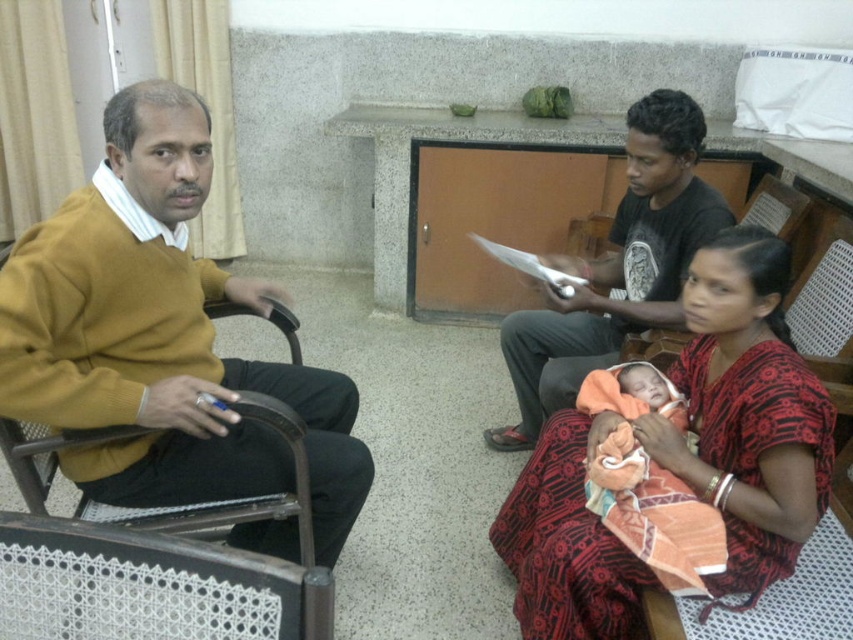
You are a nurse in this hospital scene and need to place a medical chart at a specific location. The chart must be placed at the point that is closer to the viewer. Which point should you choose between point (639, 625) and point (619, 264)?

Point (639, 625) is in front of point (619, 264), so the nurse should place the medical chart at point (639, 625) since it is closer to the viewer.

You are a patient in the hospital and need to locate two specific points on the floor plan. The first point is at coordinates point (x=91, y=296) and the second is at point (x=643, y=259). Which point is closer to the entrance of the hospital?

Point (x=91, y=296) is in front of point (x=643, y=259), so it is closer to the entrance.

You are a hospital staff member who needs to determine clothing sizes for a donation drive. Given the mustard yellow sweater at left and the black cotton shirt at center, which item has a greater width?

The mustard yellow sweater at left has a greater width than the black cotton shirt at center according to the description.